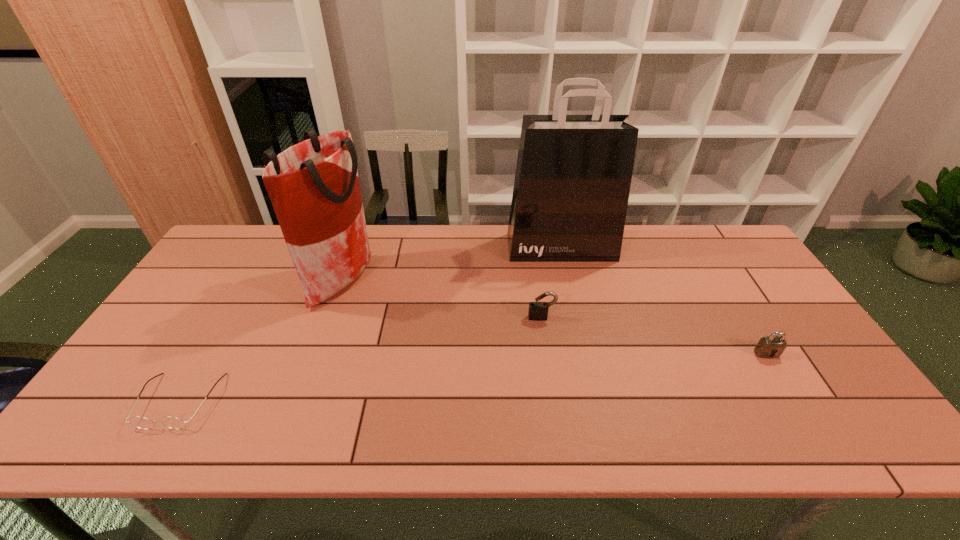
Locate an element on the screen. This screenshot has width=960, height=540. free space between the tallest object and the shorter padlock is located at coordinates (663, 300).

Where is `vacant region between the leftmost object and the fourth farthest object`? vacant region between the leftmost object and the fourth farthest object is located at coordinates (473, 377).

The height and width of the screenshot is (540, 960). I want to click on blank region between the shopping bag and the fourth shortest object, so click(x=452, y=264).

Where is `free spot between the left padlock and the second nearest object`? free spot between the left padlock and the second nearest object is located at coordinates (654, 335).

Select which object appears as the fourth closest to the right padlock. Please provide its 2D coordinates. Your answer should be formatted as a tuple, i.e. [(x, y)], where the tuple contains the x and y coordinates of a point satisfying the conditions above.

[(171, 422)]

Image resolution: width=960 pixels, height=540 pixels. Identify the location of the closest object to the tallest object. 538,311.